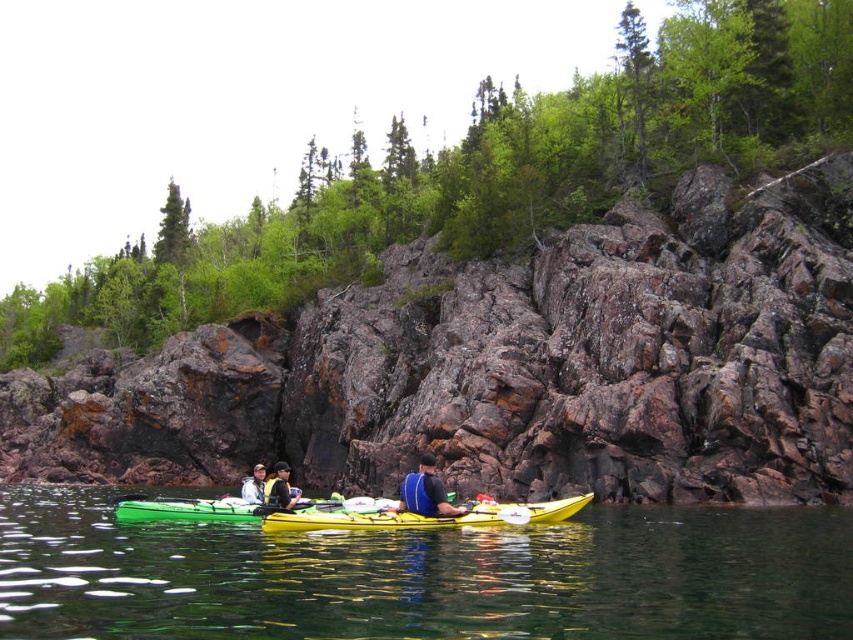
Is green rubber kayak at lower center further to the viewer compared to blue fabric life vest at center?

No, it is not.

Which is more to the left, green rubber kayak at lower center or blue fabric life vest at center?

blue fabric life vest at center is more to the left.

Is point (265, 602) positioned after point (444, 502)?

No, (265, 602) is closer to viewer.

The width and height of the screenshot is (853, 640). I want to click on green rubber kayak at lower center, so click(x=425, y=577).

Can you confirm if green rubber kayak at lower center is shorter than black fabric shirt at lower center?

Indeed, green rubber kayak at lower center has a lesser height compared to black fabric shirt at lower center.

Can you confirm if green rubber kayak at lower center is thinner than black fabric shirt at lower center?

Incorrect, green rubber kayak at lower center's width is not less than black fabric shirt at lower center's.

Which is behind, point (62, 557) or point (273, 486)?

The point (273, 486) is more distant.

At what (x,y) coordinates should I click in order to perform the action: click on green rubber kayak at lower center. Please return your answer as a coordinate pair (x, y). The width and height of the screenshot is (853, 640). Looking at the image, I should click on (425, 577).

Which of these two, green rubber kayak at lower center or yellow plastic kayak at center, stands shorter?

yellow plastic kayak at center is shorter.

Between point (325, 561) and point (476, 506), which one is positioned behind?

The point (476, 506) is more distant.

Find the location of a particular element. The height and width of the screenshot is (640, 853). green rubber kayak at lower center is located at coordinates (425, 577).